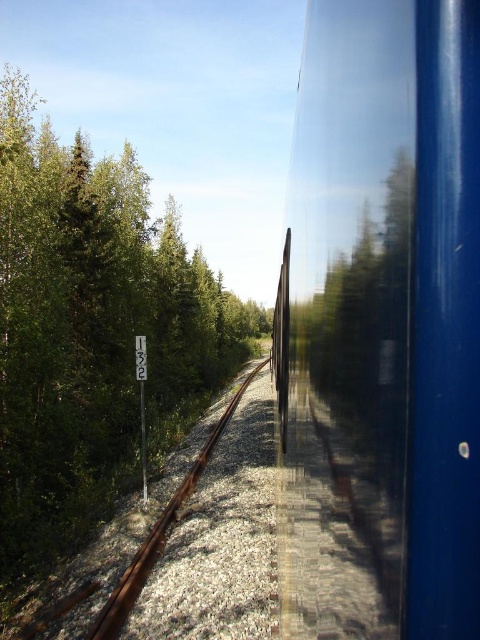
Can you confirm if green leafy trees at left is positioned to the left of rusty metal train track at center?

Yes, green leafy trees at left is to the left of rusty metal train track at center.

Is point (19, 241) closer to camera compared to point (132, 588)?

No, it is not.

You are a GUI agent. You are given a task and a screenshot of the screen. Output one action in this format:
    pyautogui.click(x=<x>, y=<y>)
    Task: Click on the green leafy trees at left
    This screenshot has height=640, width=480.
    Given the screenshot: What is the action you would take?
    pyautogui.click(x=93, y=332)

Is glossy blue train at right bigger than rusty metal train track at center?

No, glossy blue train at right is not bigger than rusty metal train track at center.

Does point (351, 81) lie in front of point (211, 442)?

Yes, it is.

Find the location of a particular element. This screenshot has width=480, height=640. glossy blue train at right is located at coordinates (381, 326).

Does glossy blue train at right have a greater width compared to green leafy trees at left?

No, glossy blue train at right is not wider than green leafy trees at left.

Is point (468, 70) closer to camera compared to point (31, 371)?

Yes, point (468, 70) is closer to viewer.

The width and height of the screenshot is (480, 640). What are the coordinates of `glossy blue train at right` in the screenshot? It's located at (381, 326).